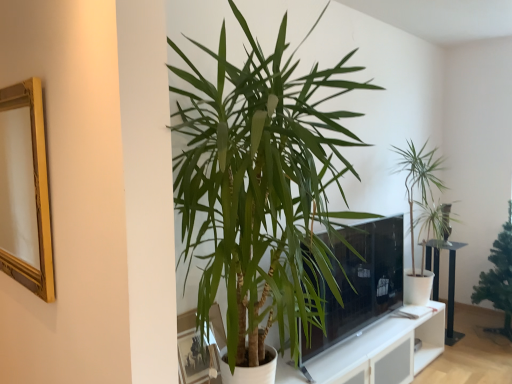
Question: Relative to green leafy plant at right, the 2th houseplant in the left-to-right sequence, is black metal table at right in front or behind?

Choices:
 (A) behind
 (B) front

Answer: (A)

Question: Is black metal table at right inside the boundaries of green leafy plant at right, which is the second houseplant from back to front, or outside?

Choices:
 (A) outside
 (B) inside

Answer: (A)

Question: Which is nearer to the black metal table at right?

Choices:
 (A) transparent glass door at center
 (B) green leafy plant at right, arranged as the second houseplant when viewed from the right
 (C) matte glass picture frame at lower center, acting as the second picture frame starting from the left
 (D) green leafy plant at center, arranged as the 1th houseplant when viewed from the left
 (E) gold wood picture frame at left, arranged as the 1th picture frame when viewed from the top

Answer: (B)

Question: Which object is the closest to the transparent glass door at center?

Choices:
 (A) matte glass picture frame at lower center, which appears as the 1th picture frame when ordered from the bottom
 (B) green leafy plant at right, acting as the third houseplant starting from the left
 (C) black metal table at right
 (D) green leafy plant at right, the 2th houseplant in the left-to-right sequence
 (E) green leafy plant at center, which is the third houseplant in back-to-front order

Answer: (D)